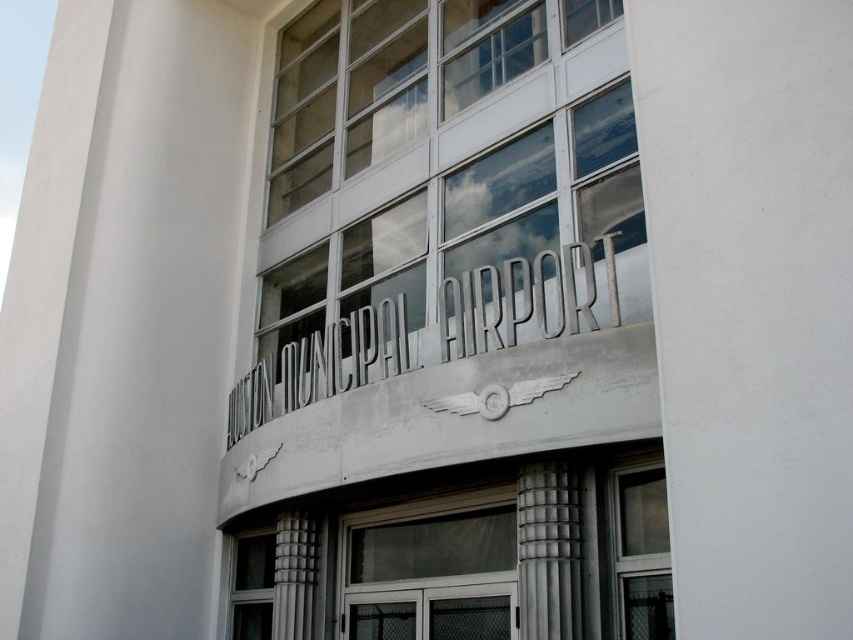
Between point (474, 598) and point (610, 589), which one is positioned in front?

Positioned in front is point (610, 589).

Does clear glass door at center have a greater width compared to clear glass window at center?

Yes.

Which is in front, point (477, 540) or point (608, 509)?

Positioned in front is point (608, 509).

You are a GUI agent. You are given a task and a screenshot of the screen. Output one action in this format:
    pyautogui.click(x=<x>, y=<y>)
    Task: Click on the clear glass door at center
    This screenshot has width=853, height=640.
    Given the screenshot: What is the action you would take?
    pyautogui.click(x=432, y=570)

Is clear glass windows at center above clear glass door at center?

Yes.

The image size is (853, 640). Describe the element at coordinates (437, 188) in the screenshot. I see `clear glass windows at center` at that location.

Is point (550, 296) positioned after point (415, 525)?

That is False.

Identify the location of clear glass windows at center. The image size is (853, 640). (437, 188).

Does clear glass windows at center have a lesser width compared to gray concrete column at right?

No.

Does clear glass windows at center have a greater width compared to gray concrete column at right?

Yes, clear glass windows at center is wider than gray concrete column at right.

Where is `clear glass windows at center`? The width and height of the screenshot is (853, 640). clear glass windows at center is located at coordinates (437, 188).

Locate an element on the screen. Image resolution: width=853 pixels, height=640 pixels. clear glass windows at center is located at coordinates (437, 188).